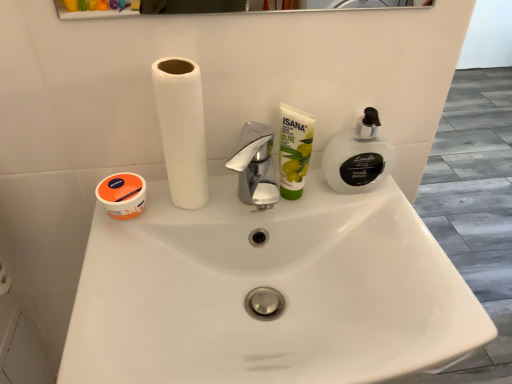
Question: Is white matte paper towel at center located outside white translucent pump at right?

Choices:
 (A) no
 (B) yes

Answer: (B)

Question: Considering the relative sizes of white matte paper towel at center and white translucent pump at right in the image provided, is white matte paper towel at center bigger than white translucent pump at right?

Choices:
 (A) no
 (B) yes

Answer: (B)

Question: From a real-world perspective, is white matte paper towel at center physically below white translucent pump at right?

Choices:
 (A) yes
 (B) no

Answer: (B)

Question: Can you confirm if white matte paper towel at center is wider than white translucent pump at right?

Choices:
 (A) yes
 (B) no

Answer: (A)

Question: From the image's perspective, is white matte paper towel at center below white translucent pump at right?

Choices:
 (A) yes
 (B) no

Answer: (B)

Question: Is white matte paper towel at center taller or shorter than white translucent pump at right?

Choices:
 (A) short
 (B) tall

Answer: (B)

Question: From a real-world perspective, is white matte paper towel at center physically located above or below white translucent pump at right?

Choices:
 (A) above
 (B) below

Answer: (A)

Question: Is white matte paper towel at center wider or thinner than white translucent pump at right?

Choices:
 (A) wide
 (B) thin

Answer: (A)

Question: In the image, is white matte paper towel at center positioned in front of or behind white translucent pump at right?

Choices:
 (A) behind
 (B) front

Answer: (B)

Question: From the image's perspective, relative to white glossy sink at center, is white matte paper towel at center above or below?

Choices:
 (A) above
 (B) below

Answer: (A)

Question: Is point (169, 81) closer or farther from the camera than point (415, 273)?

Choices:
 (A) farther
 (B) closer

Answer: (B)

Question: From their relative heights in the image, would you say white matte paper towel at center is taller or shorter than white glossy sink at center?

Choices:
 (A) short
 (B) tall

Answer: (B)

Question: Is white matte paper towel at center wider or thinner than white glossy sink at center?

Choices:
 (A) wide
 (B) thin

Answer: (B)

Question: Which is correct: green matte olive oil cream at center is inside white matte paper towel at center, or outside of it?

Choices:
 (A) outside
 (B) inside

Answer: (A)

Question: Visually, is green matte olive oil cream at center positioned to the left or to the right of white matte paper towel at center?

Choices:
 (A) right
 (B) left

Answer: (A)